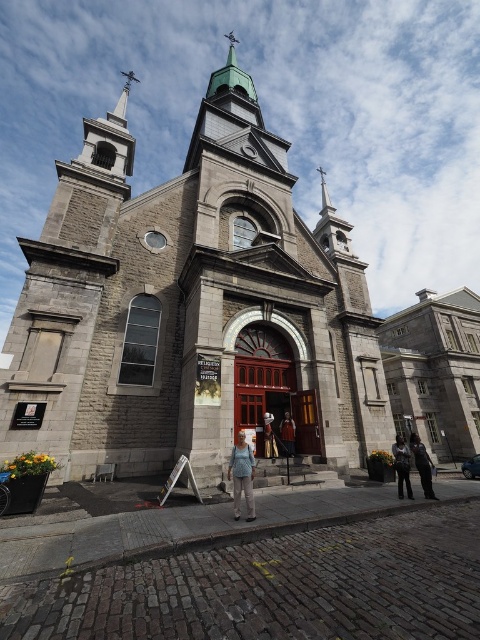
Who is positioned more to the right, denim jacket at center or denim pants at center?

denim jacket at center

Which is more to the left, denim jacket at center or denim pants at center?

From the viewer's perspective, denim pants at center appears more on the left side.

Identify the location of denim jacket at center. (288, 433).

The width and height of the screenshot is (480, 640). In order to click on denim jacket at center in this screenshot , I will do `click(288, 433)`.

Between gray stone church at center and dark gray pants at lower right, which one is positioned higher?

Positioned higher is gray stone church at center.

Is point (184, 422) positioned behind point (416, 452)?

Yes, point (184, 422) is farther from viewer.

Locate an element on the screen. The image size is (480, 640). gray stone church at center is located at coordinates (204, 314).

Where is `gray stone church at center`? gray stone church at center is located at coordinates (204, 314).

Is gray stone church at center in front of denim pants at lower right?

Yes, it is in front of denim pants at lower right.

Is point (269, 371) less distant than point (408, 476)?

No.

Identify the location of gray stone church at center. The height and width of the screenshot is (640, 480). (204, 314).